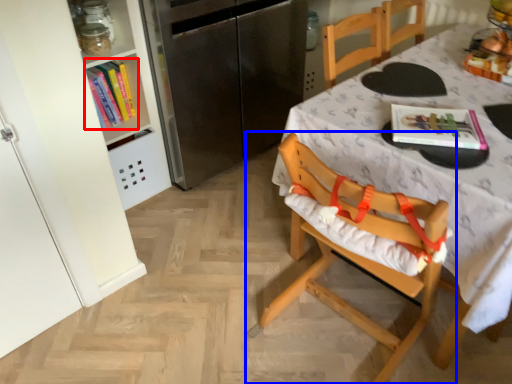
Question: Which of the following is the closest to the observer, book (highlighted by a red box) or chair (highlighted by a blue box)?

Choices:
 (A) book
 (B) chair

Answer: (B)